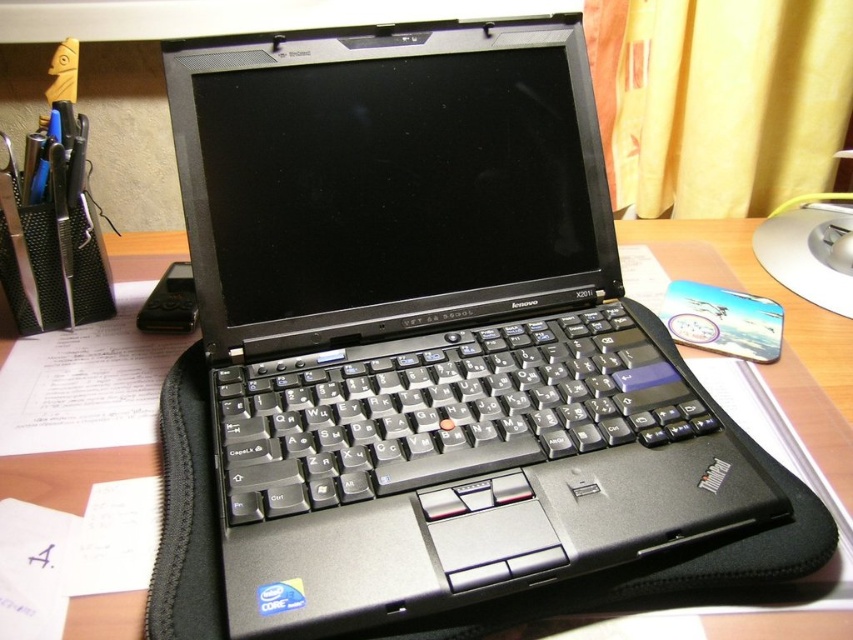
Between black matte laptop at center and black plastic keyboard at center, which one appears on the left side from the viewer's perspective?

Positioned to the left is black matte laptop at center.

Is point (316, 36) farther from viewer compared to point (273, 381)?

Yes, it is.

Locate an element on the screen. black matte laptop at center is located at coordinates (428, 330).